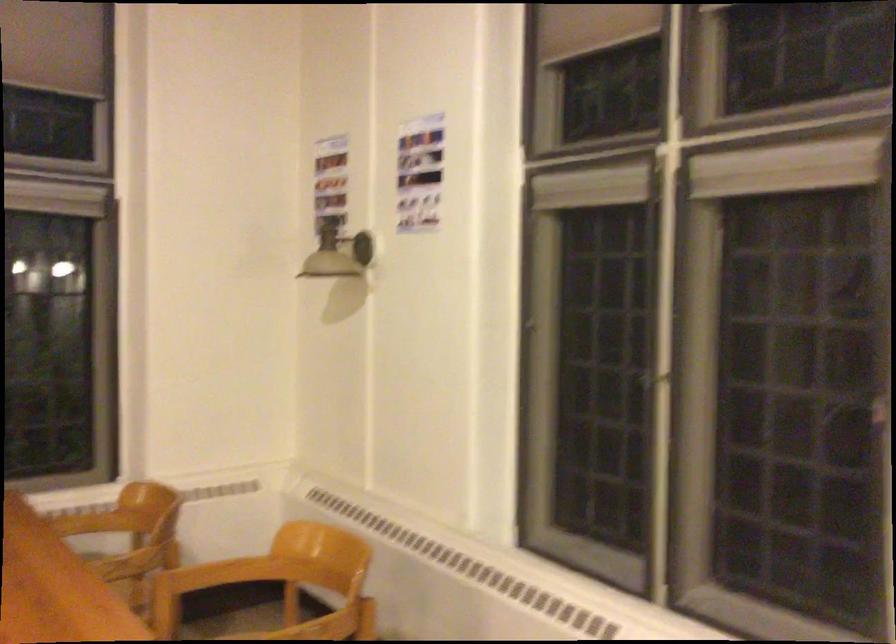
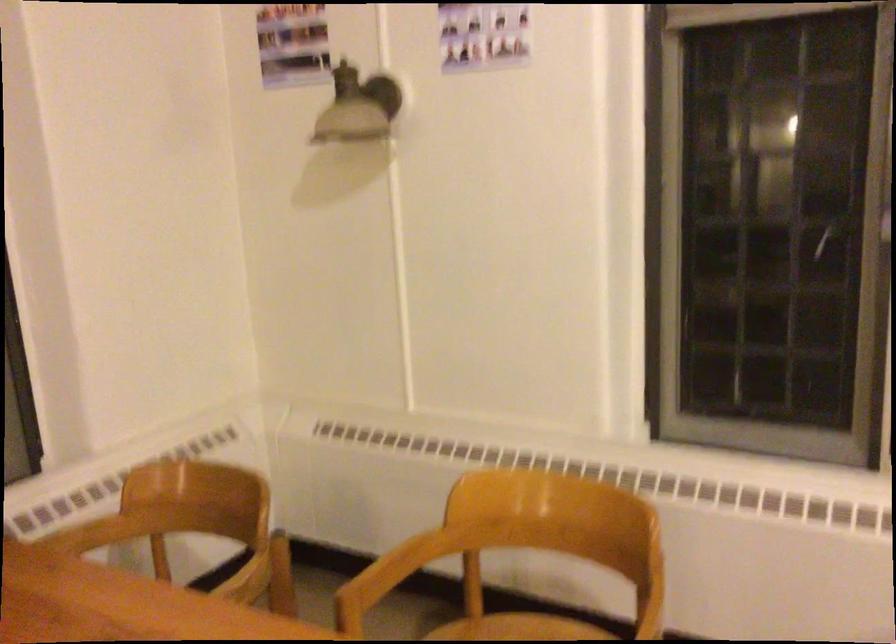
The point at (88, 527) is marked in the first image. Where is the corresponding point in the second image?

(92, 534)